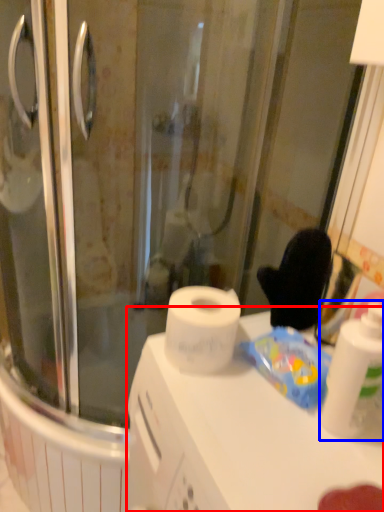
Question: Which of the following is the closest to the observer, counter top (highlighted by a red box) or cleaning product (highlighted by a blue box)?

Choices:
 (A) counter top
 (B) cleaning product

Answer: (A)